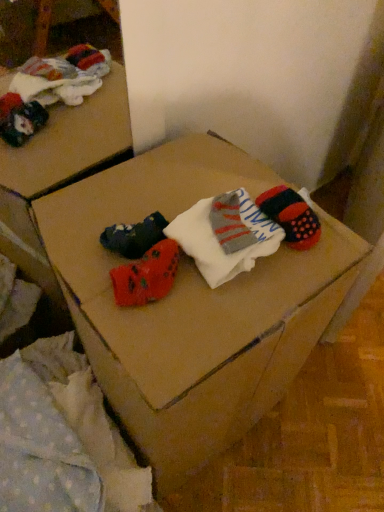
The image size is (384, 512). What are the coordinates of `free space to the left of white soft socks at center` in the screenshot? It's located at (109, 225).